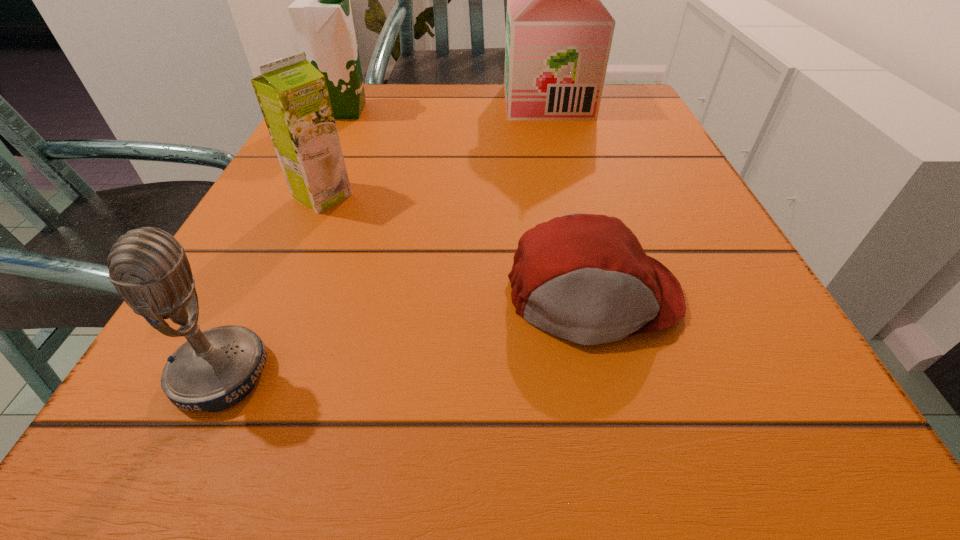
Find the location of `the tallest object`. the tallest object is located at coordinates (558, 32).

Image resolution: width=960 pixels, height=540 pixels. Find the location of `the tallest soya milk`. the tallest soya milk is located at coordinates (558, 32).

Where is `the third nearest object`? This screenshot has height=540, width=960. the third nearest object is located at coordinates (293, 96).

Find the location of a particular element. microphone is located at coordinates (213, 370).

You are a GUI agent. You are given a task and a screenshot of the screen. Output one action in this format:
    pyautogui.click(x=<x>, y=<y>)
    Task: Click on the cap
    This screenshot has height=540, width=960.
    Given the screenshot: What is the action you would take?
    pyautogui.click(x=585, y=278)

The width and height of the screenshot is (960, 540). What are the coordinates of `vacant space located 0.090m with the cap open on the tallest soya milk` in the screenshot? It's located at (465, 102).

You are a GUI agent. You are given a task and a screenshot of the screen. Output one action in this format:
    pyautogui.click(x=<x>, y=<y>)
    Task: Click on the vacant space situated 0.400m with the cap open on the tallest soya milk
    The image size is (960, 540).
    Given the screenshot: What is the action you would take?
    pyautogui.click(x=324, y=102)

Locate an element on the screen. vacant space located 0.370m with the cap open on the tallest soya milk is located at coordinates (337, 102).

Where is `vacant space located on the front of the third farthest object`? This screenshot has width=960, height=540. vacant space located on the front of the third farthest object is located at coordinates (293, 262).

Locate an element on the screen. vacant area located on the front-facing side of the microphone is located at coordinates (629, 374).